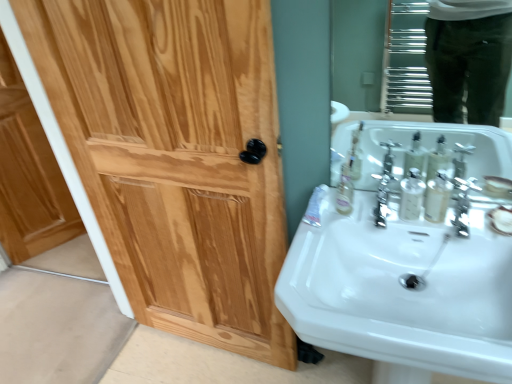
Where is `free point in front of white glossy tube at lower right`? Image resolution: width=512 pixels, height=384 pixels. free point in front of white glossy tube at lower right is located at coordinates (306, 248).